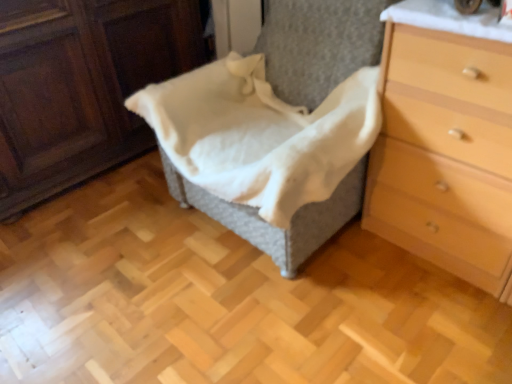
Question: Is woven fabric basket at center at the left side of light brown wood chest of drawers at right?

Choices:
 (A) yes
 (B) no

Answer: (A)

Question: Is the surface of woven fabric basket at center in direct contact with light brown wood chest of drawers at right?

Choices:
 (A) no
 (B) yes

Answer: (A)

Question: Is woven fabric basket at center behind light brown wood chest of drawers at right?

Choices:
 (A) no
 (B) yes

Answer: (B)

Question: Is woven fabric basket at center not within light brown wood chest of drawers at right?

Choices:
 (A) yes
 (B) no

Answer: (A)

Question: Does woven fabric basket at center have a larger size compared to light brown wood chest of drawers at right?

Choices:
 (A) no
 (B) yes

Answer: (B)

Question: Considering the relative sizes of woven fabric basket at center and light brown wood chest of drawers at right in the image provided, is woven fabric basket at center wider than light brown wood chest of drawers at right?

Choices:
 (A) yes
 (B) no

Answer: (A)

Question: Is light brown wood chest of drawers at right smaller than woven fabric basket at center?

Choices:
 (A) no
 (B) yes

Answer: (B)

Question: From a real-world perspective, is light brown wood chest of drawers at right located higher than woven fabric basket at center?

Choices:
 (A) yes
 (B) no

Answer: (B)

Question: Does light brown wood chest of drawers at right come in front of woven fabric basket at center?

Choices:
 (A) no
 (B) yes

Answer: (B)

Question: Is the position of light brown wood chest of drawers at right more distant than that of woven fabric basket at center?

Choices:
 (A) no
 (B) yes

Answer: (A)

Question: Is light brown wood chest of drawers at right turned away from woven fabric basket at center?

Choices:
 (A) yes
 (B) no

Answer: (B)

Question: Is light brown wood chest of drawers at right facing towards woven fabric basket at center?

Choices:
 (A) no
 (B) yes

Answer: (A)

Question: Is white cotton blanket at center at the back of light brown wood chest of drawers at right?

Choices:
 (A) no
 (B) yes

Answer: (A)